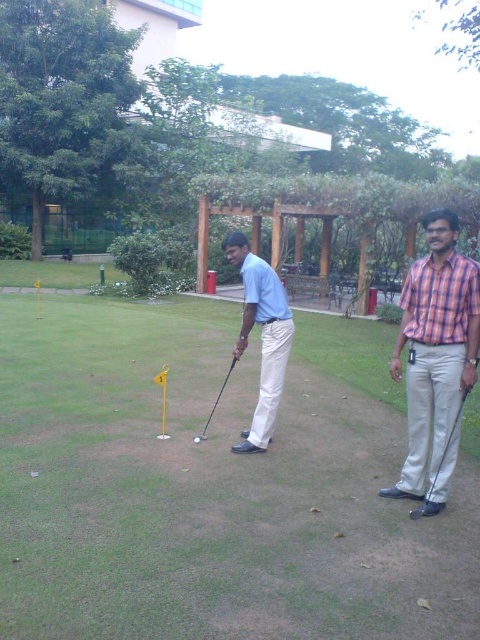
Question: Considering the relative positions of matte blue shirt at center and shiny black golf club at center in the image provided, where is matte blue shirt at center located with respect to shiny black golf club at center?

Choices:
 (A) right
 (B) left

Answer: (A)

Question: Does matte white golf ball at center have a greater width compared to shiny black golf club at center?

Choices:
 (A) no
 (B) yes

Answer: (B)

Question: Based on their relative distances, which object is nearer to the matte white golf ball at center?

Choices:
 (A) metallic silver golf club at lower right
 (B) checkered fabric shirt at right

Answer: (B)

Question: Is matte white golf ball at center positioned at the back of shiny silver golf ball at center?

Choices:
 (A) no
 (B) yes

Answer: (A)

Question: Estimate the real-world distances between objects in this image. Which object is closer to the matte white golf ball at center?

Choices:
 (A) shiny black golf club at center
 (B) metallic silver golf club at lower right
 (C) matte blue shirt at center

Answer: (A)

Question: Which point is closer to the camera taking this photo?

Choices:
 (A) (266, 426)
 (B) (468, 388)
 (C) (434, 424)
 (D) (197, 436)

Answer: (B)